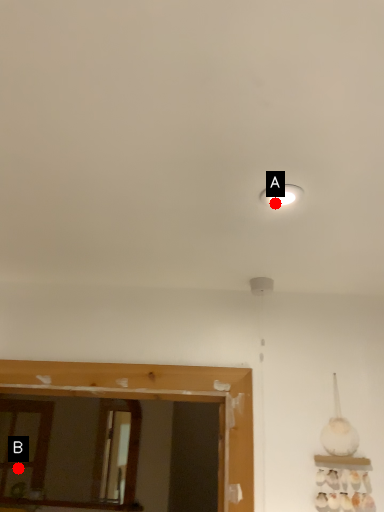
Question: Two points are circled on the image, labeled by A and B beside each circle. Which point is farther from the camera taking this photo?

Choices:
 (A) A is further
 (B) B is further

Answer: (B)